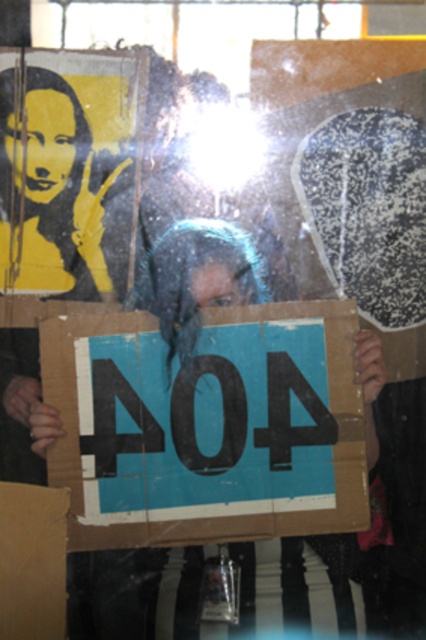
You are standing in front of a glass surface with a reflection. There is a point marked at coordinate (207, 426). What object is located at that point?

The point at coordinate (207, 426) marks the blue cardboard sign at center.

You are at an event and see the blue cardboard sign at center and the brown cardboard at lower left. Which object is closer to you?

The blue cardboard sign at center is closer to you because the brown cardboard at lower left is behind it.